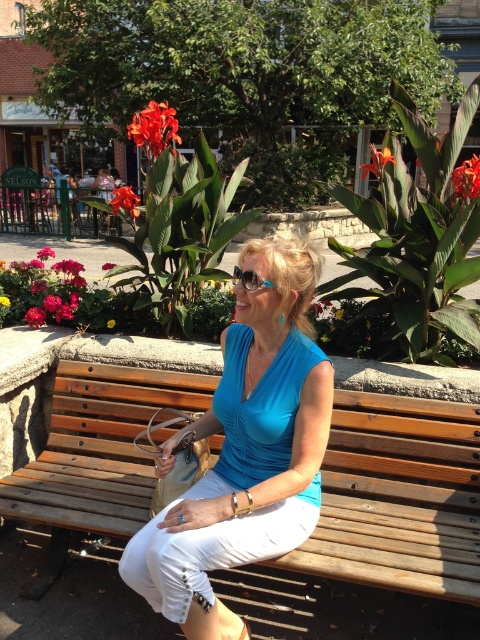
You are a photographer taking a picture of the woman in the scene. The blue fabric blouse at center and the yellow textured petals at center are both in your frame. Which object will appear closer to the camera?

The blue fabric blouse at center will appear closer to the camera because it is in front of the yellow textured petals at center.

Based on the photo, you are a photographer standing at the edge of the garden. You want to take a photo of the blue fabric blouse at center and the yellow textured petals at center so that both are in focus. The camera you have can only focus on objects within a 2 meter range. Will both subjects be in focus?

The distance between the blue fabric blouse at center and the yellow textured petals at center is 1.96 meters, which is within the 2 meter range. Therefore, both subjects will be in focus.

You are a photographer aiming to capture the woman on the wooden bench and the flowers behind her. Which flower should you focus on to ensure it appears larger in the photo, the matte red flower at center or the red matte flower at center?

The matte red flower at center is taller than the red matte flower at center, so focusing on the matte red flower at center will make it appear larger in the photo.